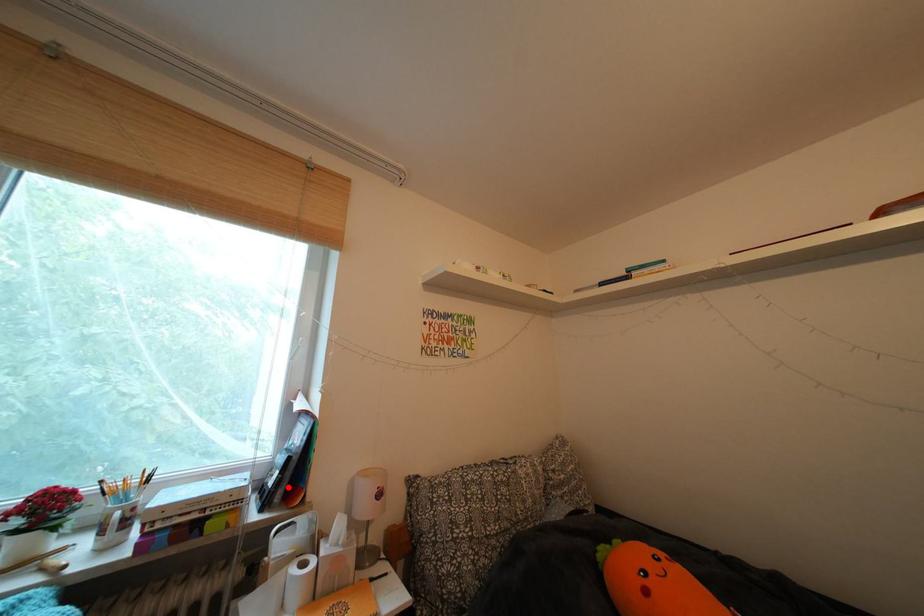
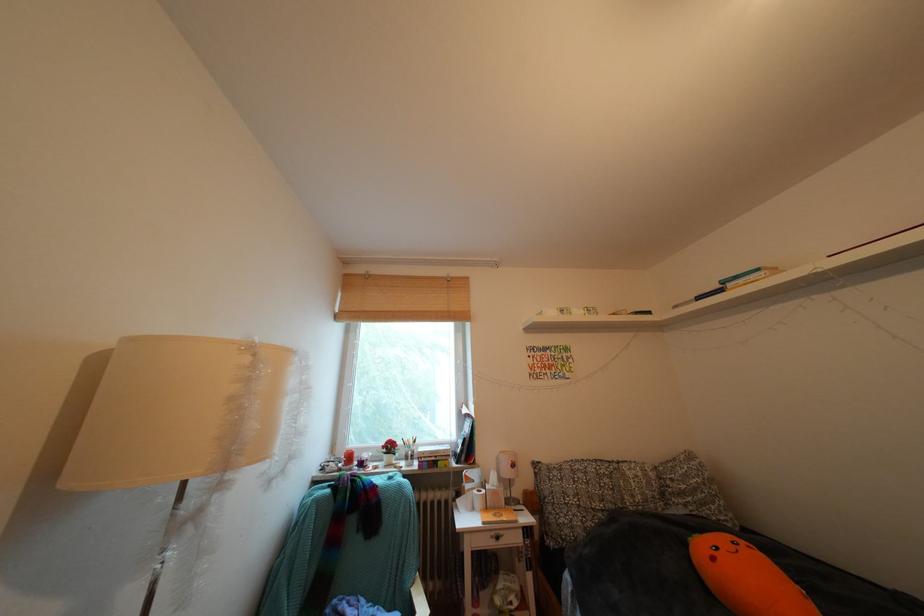
The point at the highlighted location is marked in the first image. Where is the corresponding point in the second image?

(472, 456)